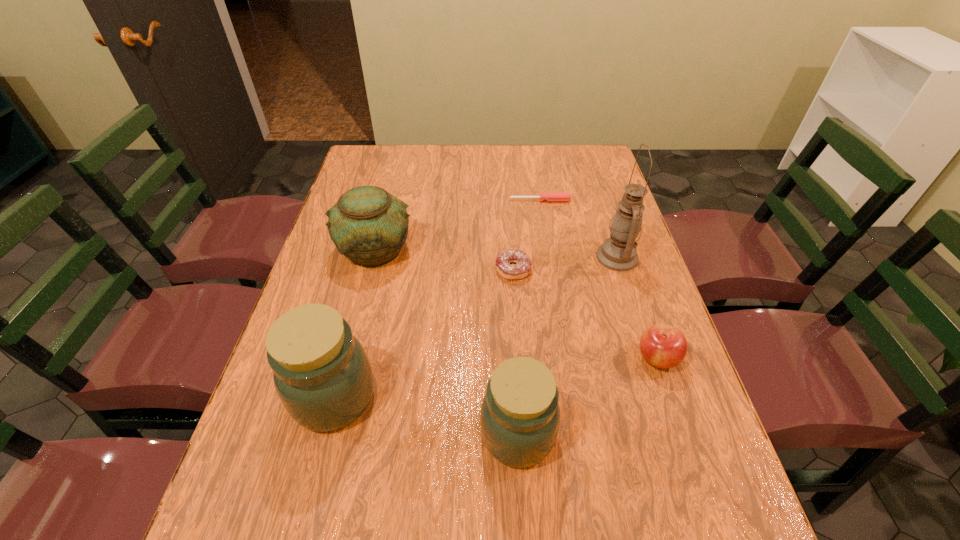
Find the location of a particular element. This screenshot has width=960, height=540. unoccupied position between the second shortest object and the right jar is located at coordinates (516, 352).

What are the coordinates of `blank region between the right jar and the second shortest object` in the screenshot? It's located at (516, 352).

Find the location of `vacant space that is in between the second tallest object and the pottery`. vacant space that is in between the second tallest object and the pottery is located at coordinates (355, 323).

At what (x,y) coordinates should I click in order to perform the action: click on vacant area that lies between the right jar and the shortest object. Please return your answer as a coordinate pair (x, y). Looking at the image, I should click on (529, 318).

Locate an element on the screen. Image resolution: width=960 pixels, height=540 pixels. vacant area that lies between the doughnut and the right jar is located at coordinates (516, 352).

The height and width of the screenshot is (540, 960). Identify the location of vacant area that lies between the pottery and the shorter jar. (446, 342).

Locate an element on the screen. free space between the pottery and the taller jar is located at coordinates coord(355,323).

Image resolution: width=960 pixels, height=540 pixels. Find the location of `free point between the right jar and the second tallest object`. free point between the right jar and the second tallest object is located at coordinates (426, 416).

Where is `free space between the taller jar and the right jar`? This screenshot has height=540, width=960. free space between the taller jar and the right jar is located at coordinates (426, 416).

At what (x,y) coordinates should I click in order to perform the action: click on object that is the fourth nearest to the right jar. Please return your answer as a coordinate pair (x, y). This screenshot has width=960, height=540. Looking at the image, I should click on (x=368, y=225).